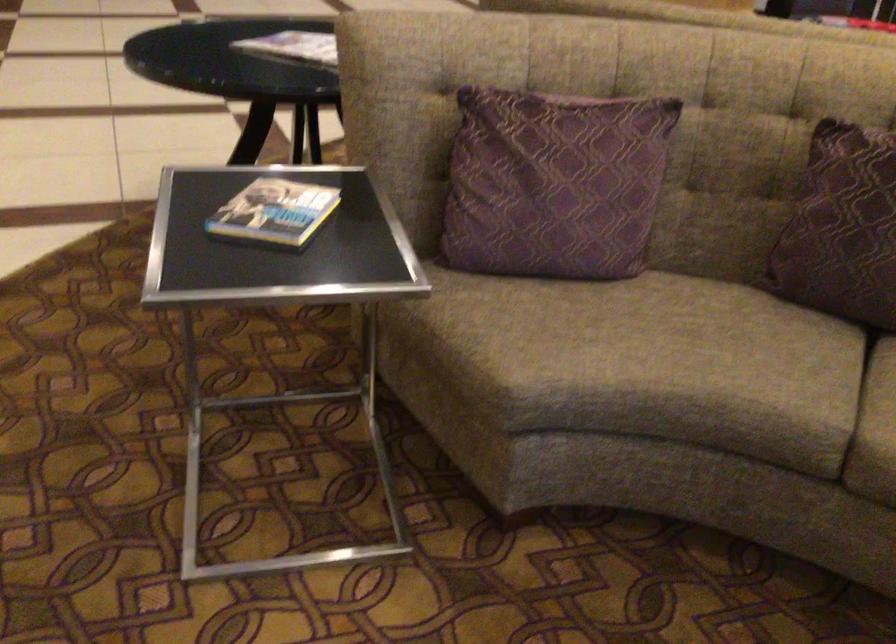
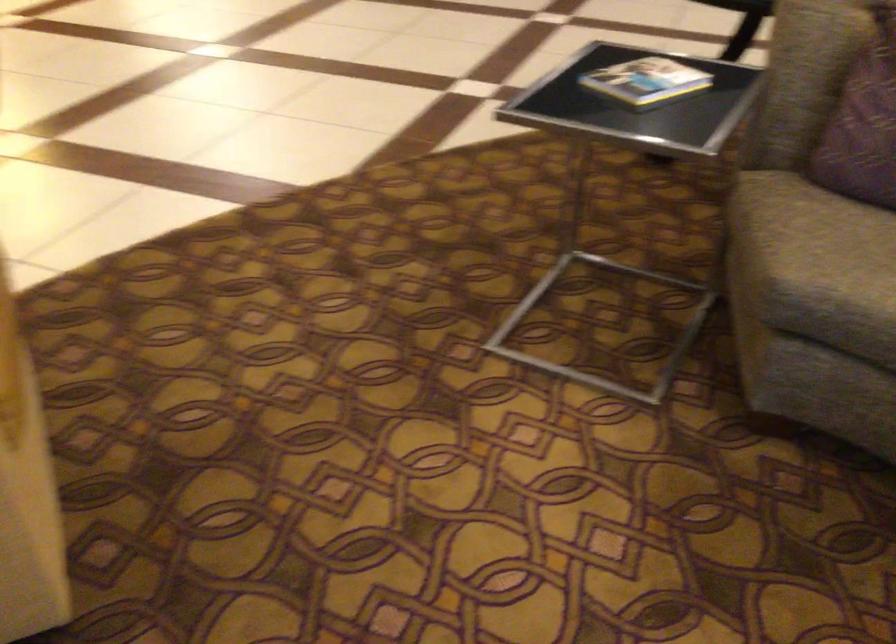
Find the pixel in the second image that matches the point at 512,324 in the first image.

(822, 234)